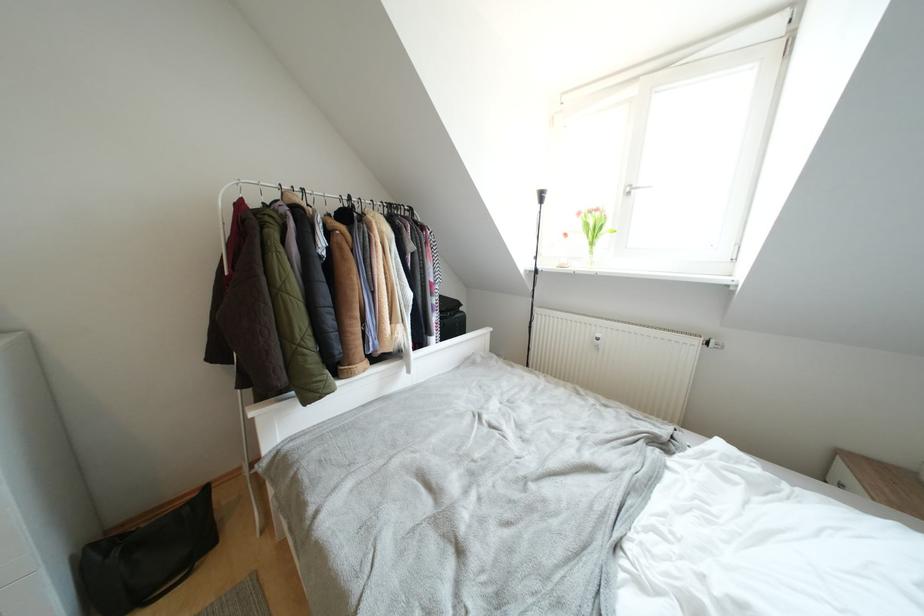
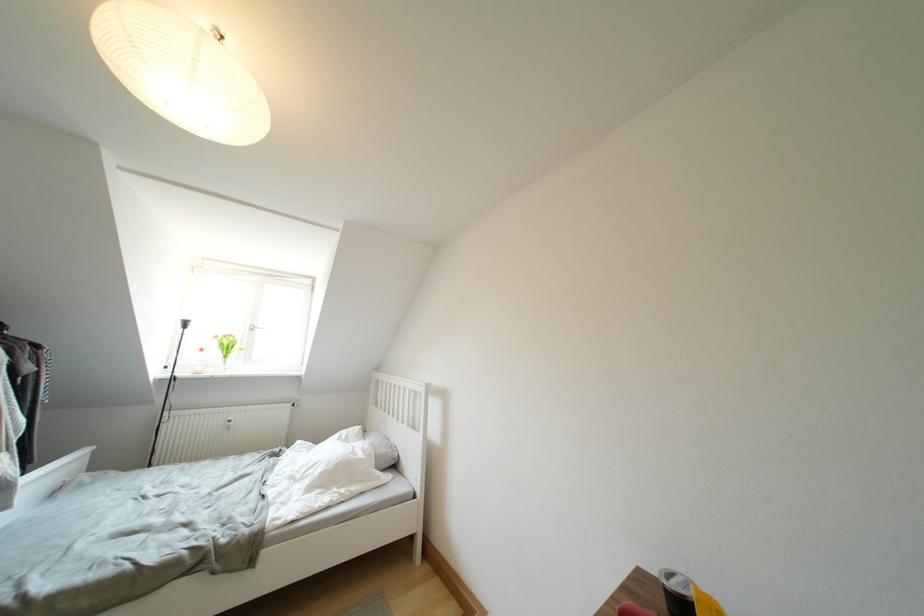
Locate, in the second image, the point that corresponds to (x=584, y=217) in the first image.

(222, 341)